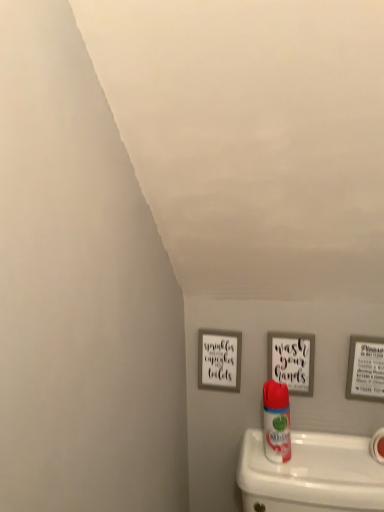
Locate an element on the screen. This screenshot has width=384, height=512. matte gray picture frame at center, which ranks as the third picture frame in right-to-left order is located at coordinates (219, 360).

What is the approximate width of white glossy air freshener at center?

white glossy air freshener at center is 2.45 inches wide.

Image resolution: width=384 pixels, height=512 pixels. In order to click on matte gray picture frame at center, which ranks as the third picture frame in right-to-left order in this screenshot , I will do pos(219,360).

Is wooden sign at center, which is the second picture frame from left to right, wider or thinner than matte gray picture frame at center, the first picture frame from the left?

wooden sign at center, which is the second picture frame from left to right, is thinner than matte gray picture frame at center, the first picture frame from the left.

Is wooden sign at center, which is the second picture frame from left to right, directly adjacent to matte gray picture frame at center, the first picture frame from the left?

No, wooden sign at center, which is the second picture frame from left to right, is not with matte gray picture frame at center, the first picture frame from the left.

Based on the photo, which is more to the right, wooden sign at center, acting as the second picture frame starting from the right, or matte gray picture frame at center, which ranks as the third picture frame in right-to-left order?

wooden sign at center, acting as the second picture frame starting from the right, is more to the right.

Can you tell me how much wooden sign at center, acting as the second picture frame starting from the right, and matte gray picture frame at center, which ranks as the third picture frame in right-to-left order, differ in facing direction?

The angular difference between wooden sign at center, acting as the second picture frame starting from the right, and matte gray picture frame at center, which ranks as the third picture frame in right-to-left order, is 1.06 degrees.

Based on the photo, can wooden sign at center, acting as the second picture frame starting from the right, be found inside white matte toilet paper at lower right?

Actually, wooden sign at center, acting as the second picture frame starting from the right, is outside white matte toilet paper at lower right.

Can you confirm if white matte toilet paper at lower right is thinner than wooden sign at center, acting as the second picture frame starting from the right?

In fact, white matte toilet paper at lower right might be wider than wooden sign at center, acting as the second picture frame starting from the right.

Can you tell me how much white matte toilet paper at lower right and wooden sign at center, acting as the second picture frame starting from the right, differ in facing direction?

white matte toilet paper at lower right and wooden sign at center, acting as the second picture frame starting from the right, are facing 0.371 degrees away from each other.

Is wooden sign at center, which is the second picture frame from left to right, at the back of white matte toilet paper at lower right?

No, white matte toilet paper at lower right is not facing the opposite direction of wooden sign at center, which is the second picture frame from left to right.

From the image's perspective, between white matte toilet paper at lower right and white glossy air freshener at center, which one is located above?

white glossy air freshener at center appears higher in the image.

Between white matte toilet paper at lower right and white glossy air freshener at center, which one is positioned in front?

white matte toilet paper at lower right is closer to the camera.

Which of these two, white matte toilet paper at lower right or white glossy air freshener at center, is wider?

With larger width is white matte toilet paper at lower right.

How distant is white matte toilet paper at lower right from white glossy air freshener at center?

white matte toilet paper at lower right is 9.89 inches from white glossy air freshener at center.

Is white glossy air freshener at center shorter than wooden sign at center, acting as the second picture frame starting from the right?

No, white glossy air freshener at center is not shorter than wooden sign at center, acting as the second picture frame starting from the right.

Is the position of white glossy air freshener at center more distant than that of wooden sign at center, acting as the second picture frame starting from the right?

No, it is not.

Between white glossy air freshener at center and wooden sign at center, which is the second picture frame from left to right, which one appears on the right side from the viewer's perspective?

wooden sign at center, which is the second picture frame from left to right, is more to the right.

Is white glossy air freshener at center wider or thinner than wooden sign at center, which is the second picture frame from left to right?

white glossy air freshener at center is wider than wooden sign at center, which is the second picture frame from left to right.

How far apart are matte gray picture frame at center, the first picture frame from the left, and matte gray picture frame at right, which is counted as the 1th picture frame, starting from the right?

matte gray picture frame at center, the first picture frame from the left, and matte gray picture frame at right, which is counted as the 1th picture frame, starting from the right, are 13.33 inches apart from each other.

How many degrees apart are the facing directions of matte gray picture frame at center, the first picture frame from the left, and matte gray picture frame at right, which is counted as the 1th picture frame, starting from the right?

The angular difference between matte gray picture frame at center, the first picture frame from the left, and matte gray picture frame at right, which is counted as the 1th picture frame, starting from the right, is 1.19 degrees.

Which object is positioned more to the right, matte gray picture frame at center, which ranks as the third picture frame in right-to-left order, or matte gray picture frame at right, which ranks as the 3th picture frame in left-to-right order?

Positioned to the right is matte gray picture frame at right, which ranks as the 3th picture frame in left-to-right order.

From the picture: Is matte gray picture frame at right, which ranks as the 3th picture frame in left-to-right order, completely or partially inside matte gray picture frame at center, the first picture frame from the left?

No, matte gray picture frame at right, which ranks as the 3th picture frame in left-to-right order, is not a part of matte gray picture frame at center, the first picture frame from the left.

Looking at this image, could you measure the distance between white glossy air freshener at center and matte gray picture frame at center, the first picture frame from the left?

6.52 inches.

Is white glossy air freshener at center shorter than matte gray picture frame at center, the first picture frame from the left?

In fact, white glossy air freshener at center may be taller than matte gray picture frame at center, the first picture frame from the left.

Considering the sizes of white glossy air freshener at center and matte gray picture frame at center, which ranks as the third picture frame in right-to-left order, in the image, is white glossy air freshener at center bigger or smaller than matte gray picture frame at center, which ranks as the third picture frame in right-to-left order,?

Considering their sizes, white glossy air freshener at center takes up more space than matte gray picture frame at center, which ranks as the third picture frame in right-to-left order.

From the image's perspective, is white glossy air freshener at center below matte gray picture frame at center, the first picture frame from the left?

Indeed, from the image's perspective, white glossy air freshener at center is shown beneath matte gray picture frame at center, the first picture frame from the left.

Does matte gray picture frame at center, which ranks as the third picture frame in right-to-left order, turn towards white matte toilet paper at lower right?

No, matte gray picture frame at center, which ranks as the third picture frame in right-to-left order, does not turn towards white matte toilet paper at lower right.

Where is `picture frame that is the 3rd one when counting backward from the white matte toilet paper at lower right`? This screenshot has width=384, height=512. picture frame that is the 3rd one when counting backward from the white matte toilet paper at lower right is located at coordinates (219, 360).

From a real-world perspective, which object stands above the other?

matte gray picture frame at center, the first picture frame from the left, is physically above.

Is matte gray picture frame at center, the first picture frame from the left, to the right of white matte toilet paper at lower right from the viewer's perspective?

No.

From a real-world perspective, count 1st picture frames downward from the wooden sign at center, which is the second picture frame from left to right, and point to it. Please provide its 2D coordinates.

[(219, 360)]

Where is `the 2nd picture frame counting from the left of the white matte toilet paper at lower right`? The height and width of the screenshot is (512, 384). the 2nd picture frame counting from the left of the white matte toilet paper at lower right is located at coordinates (292, 361).

Looking at the image, which one is located further to white glossy air freshener at center, matte gray picture frame at center, the first picture frame from the left, or white matte toilet paper at lower right?

white matte toilet paper at lower right is further to white glossy air freshener at center.

When comparing their distances from white matte toilet paper at lower right, does matte gray picture frame at right, which ranks as the 3th picture frame in left-to-right order, or matte gray picture frame at center, the first picture frame from the left, seem closer?

Based on the image, matte gray picture frame at right, which ranks as the 3th picture frame in left-to-right order, appears to be nearer to white matte toilet paper at lower right.

In the scene shown: When comparing their distances from wooden sign at center, which is the second picture frame from left to right, does matte gray picture frame at right, which ranks as the 3th picture frame in left-to-right order, or white glossy air freshener at center seem closer?

white glossy air freshener at center is closer to wooden sign at center, which is the second picture frame from left to right.

Considering their positions, is matte gray picture frame at right, which is counted as the 1th picture frame, starting from the right, positioned closer to wooden sign at center, acting as the second picture frame starting from the right, than white matte toilet paper at lower right?

matte gray picture frame at right, which is counted as the 1th picture frame, starting from the right, lies closer to wooden sign at center, acting as the second picture frame starting from the right, than the other object.

When comparing their distances from white glossy air freshener at center, does matte gray picture frame at right, which is counted as the 1th picture frame, starting from the right, or white matte toilet paper at lower right seem closer?

The object closer to white glossy air freshener at center is matte gray picture frame at right, which is counted as the 1th picture frame, starting from the right.

From the picture: Based on their spatial positions, is matte gray picture frame at right, which is counted as the 1th picture frame, starting from the right, or white glossy air freshener at center further from white matte toilet paper at lower right?

white glossy air freshener at center lies further to white matte toilet paper at lower right than the other object.

When comparing their distances from white glossy air freshener at center, does matte gray picture frame at center, the first picture frame from the left, or matte gray picture frame at right, which ranks as the 3th picture frame in left-to-right order, seem closer?

matte gray picture frame at center, the first picture frame from the left.

Estimate the real-world distances between objects in this image. Which object is closer to wooden sign at center, which is the second picture frame from left to right, white matte toilet paper at lower right or white glossy air freshener at center?

white glossy air freshener at center is positioned closer to the anchor wooden sign at center, which is the second picture frame from left to right.

You are a GUI agent. You are given a task and a screenshot of the screen. Output one action in this format:
    pyautogui.click(x=<x>, y=<y>)
    Task: Click on the picture frame situated between white glossy air freshener at center and matte gray picture frame at right, which is counted as the 1th picture frame, starting from the right, from left to right
    
    Given the screenshot: What is the action you would take?
    [292, 361]

I want to click on cleaning product between matte gray picture frame at center, the first picture frame from the left, and matte gray picture frame at right, which is counted as the 1th picture frame, starting from the right, so click(276, 422).

Where is `cleaning product located between matte gray picture frame at center, the first picture frame from the left, and white matte toilet paper at lower right in the left-right direction`? cleaning product located between matte gray picture frame at center, the first picture frame from the left, and white matte toilet paper at lower right in the left-right direction is located at coordinates (276, 422).

In order to click on picture frame between matte gray picture frame at center, which ranks as the third picture frame in right-to-left order, and matte gray picture frame at right, which is counted as the 1th picture frame, starting from the right in this screenshot , I will do `click(292, 361)`.